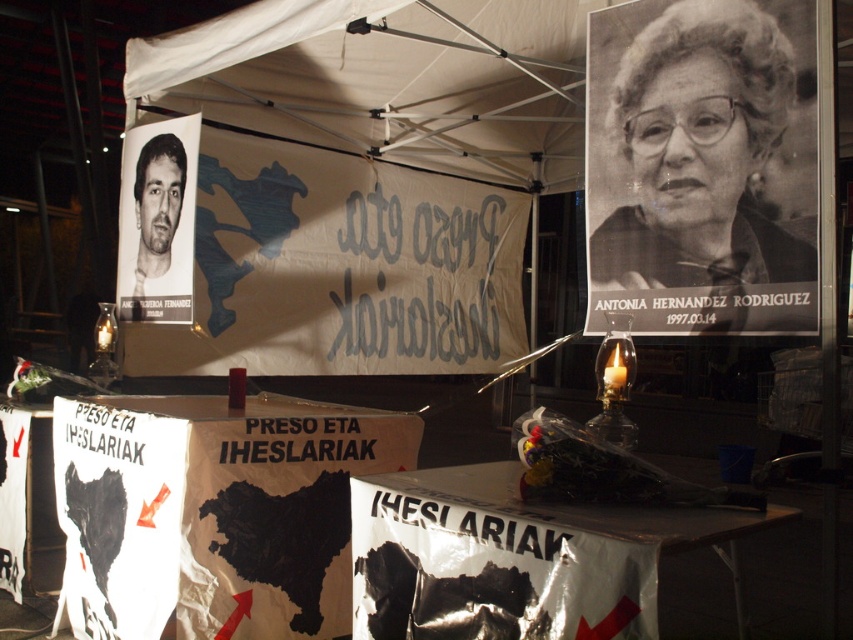
Question: Can you confirm if white paper map at center is positioned below black paper portrait at upper right?

Choices:
 (A) no
 (B) yes

Answer: (B)

Question: Is white paper poster at left to the right of matte black photo at upper left from the viewer's perspective?

Choices:
 (A) yes
 (B) no

Answer: (A)

Question: Which of these objects is positioned farthest from the white paper map at center?

Choices:
 (A) metallic reflective table at center
 (B) matte black photo at upper left
 (C) white paper poster at left
 (D) black paper portrait at upper right

Answer: (D)

Question: Among these points, which one is nearest to the camera?

Choices:
 (A) (234, 275)
 (B) (283, 602)
 (C) (639, 234)

Answer: (C)

Question: Is white paper poster at left to the right of metallic reflective table at center from the viewer's perspective?

Choices:
 (A) no
 (B) yes

Answer: (A)

Question: Based on their relative distances, which object is nearer to the metallic reflective table at center?

Choices:
 (A) white paper poster at left
 (B) white paper map at center
 (C) matte black photo at upper left
 (D) black paper portrait at upper right

Answer: (D)